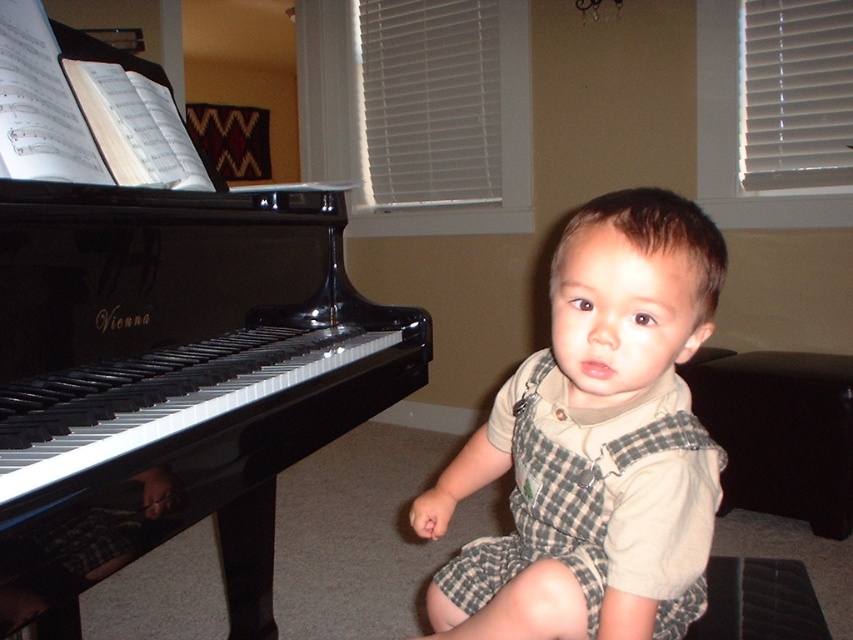
Question: Can you confirm if light beige plaid overalls at center is positioned below black leather stool at lower right?

Choices:
 (A) yes
 (B) no

Answer: (B)

Question: Which object appears farthest from the camera in this image?

Choices:
 (A) light beige plaid overalls at center
 (B) black glossy piano at left

Answer: (A)

Question: From the image, what is the correct spatial relationship of black glossy piano at left in relation to light beige plaid overalls at center?

Choices:
 (A) above
 (B) below

Answer: (A)

Question: Which of these objects is positioned closest to the black glossy piano at left?

Choices:
 (A) light beige plaid overalls at center
 (B) black leather stool at lower right

Answer: (A)

Question: Is light beige plaid overalls at center further to camera compared to black leather stool at lower right?

Choices:
 (A) yes
 (B) no

Answer: (B)

Question: Which of the following is the farthest from the observer?

Choices:
 (A) black glossy piano at left
 (B) black leather stool at lower right

Answer: (B)